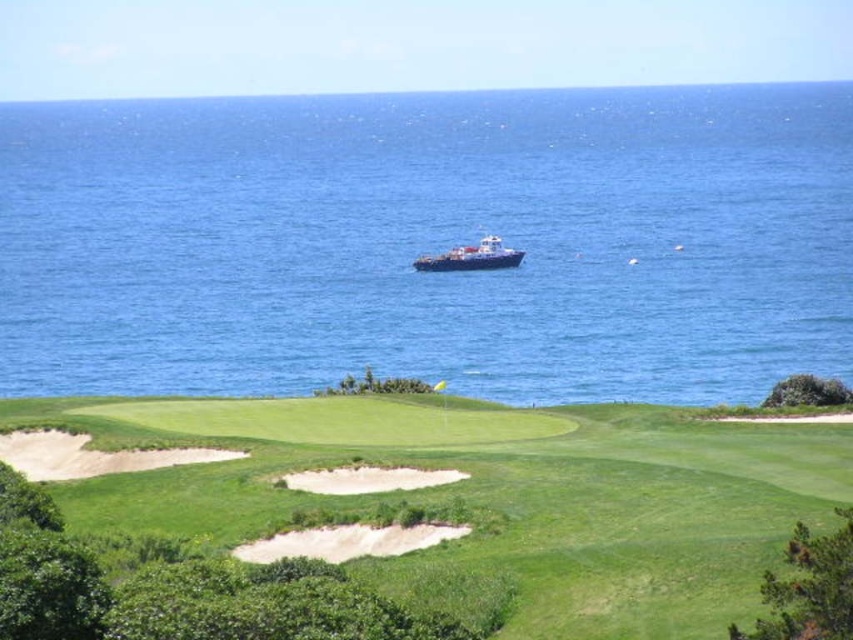
Can you confirm if green grassy golf course at lower center is bigger than white sand bunker at center?

Correct, green grassy golf course at lower center is larger in size than white sand bunker at center.

Identify the location of green grassy golf course at lower center. (x=492, y=493).

Is blue water at center to the right of blue metallic ship at center from the viewer's perspective?

No, blue water at center is not to the right of blue metallic ship at center.

Is blue water at center positioned before blue metallic ship at center?

Yes, blue water at center is closer to the viewer.

Between point (332, 371) and point (479, 241), which one is positioned in front?

Point (332, 371)

Where is `blue water at center`? blue water at center is located at coordinates (428, 243).

Looking at this image, can you confirm if green grassy golf course at lower center is wider than blue metallic ship at center?

Indeed, green grassy golf course at lower center has a greater width compared to blue metallic ship at center.

Is green grassy golf course at lower center shorter than blue metallic ship at center?

Indeed, green grassy golf course at lower center has a lesser height compared to blue metallic ship at center.

The height and width of the screenshot is (640, 853). What do you see at coordinates (492, 493) in the screenshot?
I see `green grassy golf course at lower center` at bounding box center [492, 493].

You are a GUI agent. You are given a task and a screenshot of the screen. Output one action in this format:
    pyautogui.click(x=<x>, y=<y>)
    Task: Click on the green grassy golf course at lower center
    This screenshot has height=640, width=853.
    Given the screenshot: What is the action you would take?
    pyautogui.click(x=492, y=493)